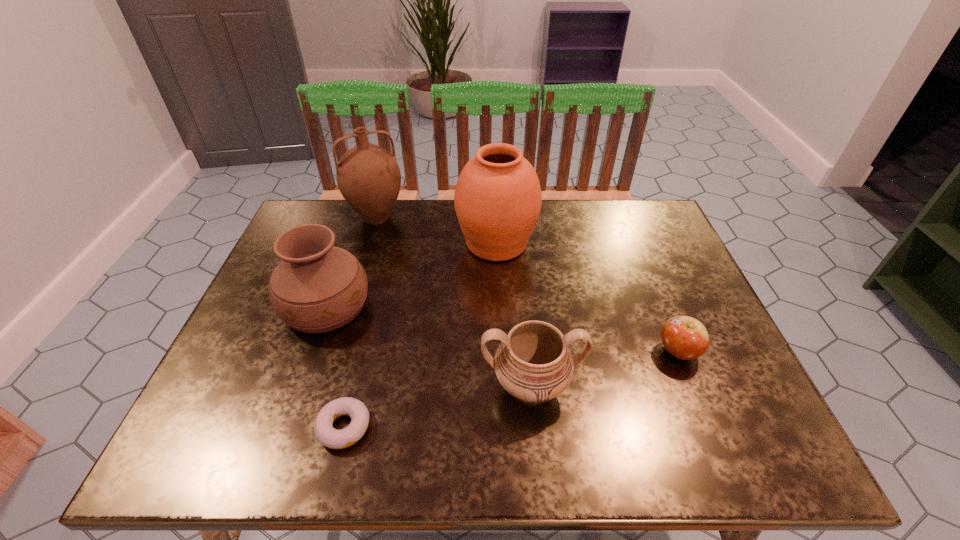
You are a GUI agent. You are given a task and a screenshot of the screen. Output one action in this format:
    pyautogui.click(x=<x>, y=<y>)
    Task: Click on the vacant space situated 0.120m on the right of the farthest urn
    The height and width of the screenshot is (540, 960).
    Given the screenshot: What is the action you would take?
    pyautogui.click(x=578, y=243)

Find the location of `vacant point located 0.110m on the right of the third tallest object`. vacant point located 0.110m on the right of the third tallest object is located at coordinates (415, 306).

Find the location of a particular element. The image size is (960, 540). vacant area located 0.070m on the front-facing side of the shortest urn is located at coordinates (538, 454).

Where is `vacant space located on the back of the second shortest object`? vacant space located on the back of the second shortest object is located at coordinates (643, 265).

Identify the location of free spot located on the back of the shortest object. (364, 346).

I want to click on pitcher that is at the far edge, so [368, 176].

Find the location of a particular element. urn located at the far edge is located at coordinates (498, 198).

You are a GUI agent. You are given a task and a screenshot of the screen. Output one action in this format:
    pyautogui.click(x=<x>, y=<y>)
    Task: Click on the object that is at the near edge
    
    Given the screenshot: What is the action you would take?
    tap(328, 436)

Where is `pitcher positioned at the left edge`? Image resolution: width=960 pixels, height=540 pixels. pitcher positioned at the left edge is located at coordinates (368, 176).

This screenshot has height=540, width=960. I want to click on urn located in the left edge section of the desktop, so click(x=316, y=288).